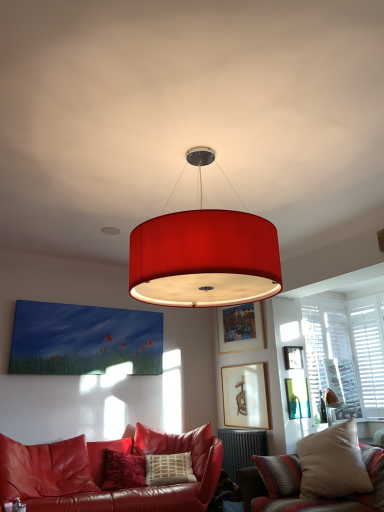
Question: Which direction should I rotate to face wooden picture frame at upper center, the second picture frame in the top-to-bottom sequence, — up or down?

Choices:
 (A) down
 (B) up

Answer: (A)

Question: Can you confirm if wooden picture frame at upper center, the 1th picture frame when ordered from top to bottom, is thinner than matte wooden picture frame at center, the 1th picture frame in the bottom-to-top sequence?

Choices:
 (A) no
 (B) yes

Answer: (A)

Question: Does wooden picture frame at upper center, the 4th picture frame in the bottom-to-top sequence, appear on the right side of matte wooden picture frame at center, which is counted as the 4th picture frame, starting from the top?

Choices:
 (A) no
 (B) yes

Answer: (A)

Question: From a real-world perspective, is wooden picture frame at upper center, the 1th picture frame when ordered from top to bottom, over matte wooden picture frame at center, the 1th picture frame in the bottom-to-top sequence?

Choices:
 (A) yes
 (B) no

Answer: (A)

Question: Is wooden picture frame at upper center, the 4th picture frame in the bottom-to-top sequence, next to matte wooden picture frame at center, which is counted as the 4th picture frame, starting from the top?

Choices:
 (A) yes
 (B) no

Answer: (B)

Question: From a real-world perspective, is wooden picture frame at upper center, the 1th picture frame when ordered from top to bottom, physically below matte wooden picture frame at center, which is counted as the 4th picture frame, starting from the top?

Choices:
 (A) yes
 (B) no

Answer: (B)

Question: Is wooden picture frame at upper center, the 1th picture frame when ordered from top to bottom, not within matte wooden picture frame at center, which is counted as the 4th picture frame, starting from the top?

Choices:
 (A) no
 (B) yes

Answer: (B)

Question: Is satin red couch at lower left, the first studio couch in the left-to-right sequence, taller than velvet beige pillow at lower right, which ranks as the first studio couch in right-to-left order?

Choices:
 (A) yes
 (B) no

Answer: (A)

Question: Can you confirm if satin red couch at lower left, which is the 2th studio couch from right to left, is wider than velvet beige pillow at lower right, which ranks as the first studio couch in right-to-left order?

Choices:
 (A) no
 (B) yes

Answer: (B)

Question: Can you confirm if satin red couch at lower left, which is the 2th studio couch from right to left, is smaller than velvet beige pillow at lower right, which ranks as the first studio couch in right-to-left order?

Choices:
 (A) no
 (B) yes

Answer: (A)

Question: From the image's perspective, is satin red couch at lower left, the first studio couch in the left-to-right sequence, located beneath velvet beige pillow at lower right, which ranks as the first studio couch in right-to-left order?

Choices:
 (A) yes
 (B) no

Answer: (A)

Question: Does satin red couch at lower left, which is the 2th studio couch from right to left, come behind velvet beige pillow at lower right, which ranks as the first studio couch in right-to-left order?

Choices:
 (A) no
 (B) yes

Answer: (B)

Question: Considering the relative sizes of satin red couch at lower left, the first studio couch in the left-to-right sequence, and velvet beige pillow at lower right, the second studio couch viewed from the left, in the image provided, is satin red couch at lower left, the first studio couch in the left-to-right sequence, bigger than velvet beige pillow at lower right, the second studio couch viewed from the left,?

Choices:
 (A) no
 (B) yes

Answer: (B)

Question: From a real-world perspective, is matte red drum shade at center on matte wooden picture frame at center, the 1th picture frame in the bottom-to-top sequence?

Choices:
 (A) yes
 (B) no

Answer: (A)